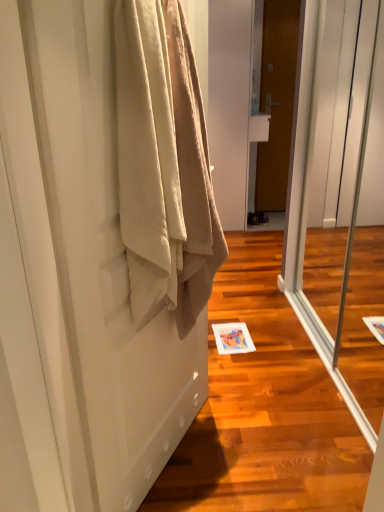
Where is `unoccupied space behind transparent glass screen door at center`? unoccupied space behind transparent glass screen door at center is located at coordinates (290, 306).